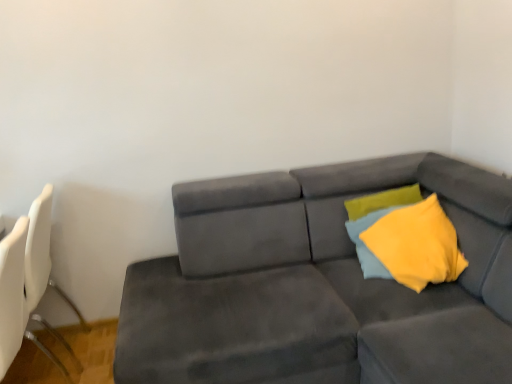
What do you see at coordinates (318, 284) in the screenshot? I see `suede gray couch at center` at bounding box center [318, 284].

Describe the element at coordinates (368, 227) in the screenshot. I see `soft yellow fabric pillow at right` at that location.

Identify the location of white plastic swivel chair at left. The width and height of the screenshot is (512, 384). (42, 266).

Is suede gray couch at center not near yellow fabric pillow at upper right?

suede gray couch at center is near yellow fabric pillow at upper right, not far away.

Considering the relative sizes of suede gray couch at center and yellow fabric pillow at upper right in the image provided, is suede gray couch at center wider than yellow fabric pillow at upper right?

Yes, suede gray couch at center is wider than yellow fabric pillow at upper right.

Is suede gray couch at center in front of or behind yellow fabric pillow at upper right in the image?

Clearly, suede gray couch at center is in front of yellow fabric pillow at upper right.

Considering the relative positions of suede gray couch at center and yellow fabric pillow at upper right in the image provided, is suede gray couch at center to the left of yellow fabric pillow at upper right from the viewer's perspective?

Yes, suede gray couch at center is to the left of yellow fabric pillow at upper right.

This screenshot has width=512, height=384. In order to click on swivel chair located underneath the soft yellow fabric pillow at right (from a real-world perspective) in this screenshot , I will do `click(42, 266)`.

Considering the sizes of objects soft yellow fabric pillow at right and white plastic swivel chair at left in the image provided, who is taller, soft yellow fabric pillow at right or white plastic swivel chair at left?

white plastic swivel chair at left.

Between point (372, 273) and point (39, 235), which one is positioned behind?

The point (39, 235) is farther.

From a real-world perspective, is suede gray couch at center under soft yellow fabric pillow at right?

Yes, from a real-world perspective, suede gray couch at center is under soft yellow fabric pillow at right.

Is suede gray couch at center next to soft yellow fabric pillow at right and touching it?

There is a gap between suede gray couch at center and soft yellow fabric pillow at right.

Based on the photo, which of these two, suede gray couch at center or soft yellow fabric pillow at right, is bigger?

suede gray couch at center.

From the image's perspective, which one is positioned higher, suede gray couch at center or soft yellow fabric pillow at right?

soft yellow fabric pillow at right, from the image's perspective.

Looking at this image, from a real-world perspective, who is located lower, yellow fabric pillow at upper right or suede gray couch at center?

In real-world perspective, suede gray couch at center is lower.

Is yellow fabric pillow at upper right far away from suede gray couch at center?

No, yellow fabric pillow at upper right is not far away from suede gray couch at center.

Does yellow fabric pillow at upper right lie behind suede gray couch at center?

Yes, yellow fabric pillow at upper right is further from the viewer.

Which of these two, yellow fabric pillow at upper right or suede gray couch at center, is smaller?

yellow fabric pillow at upper right.

Find the location of a particular element. The image size is (512, 384). studio couch directly beneath the white plastic swivel chair at left (from a real-world perspective) is located at coordinates (318, 284).

Is white plastic swivel chair at left surrounding suede gray couch at center?

No, suede gray couch at center is located outside of white plastic swivel chair at left.

Is white plastic swivel chair at left oriented away from suede gray couch at center?

Yes, suede gray couch at center is at the back of white plastic swivel chair at left.

How far apart are white plastic swivel chair at left and suede gray couch at center?

white plastic swivel chair at left is 3.63 feet from suede gray couch at center.

Is soft yellow fabric pillow at right wider or thinner than yellow fabric pillow at upper right?

Clearly, soft yellow fabric pillow at right has less width compared to yellow fabric pillow at upper right.

Does soft yellow fabric pillow at right have a larger size compared to yellow fabric pillow at upper right?

No.

How different are the orientations of soft yellow fabric pillow at right and yellow fabric pillow at upper right in degrees?

The facing directions of soft yellow fabric pillow at right and yellow fabric pillow at upper right are 0.000164 degrees apart.

You are a GUI agent. You are given a task and a screenshot of the screen. Output one action in this format:
    pyautogui.click(x=<x>, y=<y>)
    Task: Click on the pillow on the left of the yellow fabric pillow at upper right
    
    Given the screenshot: What is the action you would take?
    pyautogui.click(x=368, y=227)

Is suede gray couch at center at the right side of white plastic swivel chair at left?

Yes.

Can you confirm if suede gray couch at center is taller than white plastic swivel chair at left?

No, suede gray couch at center is not taller than white plastic swivel chair at left.

Between suede gray couch at center and white plastic swivel chair at left, which one has larger size?

Bigger between the two is suede gray couch at center.

Where is `throw pillow that is above the suede gray couch at center (from the image's perspective)`? This screenshot has height=384, width=512. throw pillow that is above the suede gray couch at center (from the image's perspective) is located at coordinates (417, 244).

Identify the location of swivel chair on the left side of soft yellow fabric pillow at right. (42, 266).

From the picture: From the image, which object appears to be nearer to suede gray couch at center, yellow fabric pillow at upper right or white plastic swivel chair at left?

Based on the image, yellow fabric pillow at upper right appears to be nearer to suede gray couch at center.

Based on their spatial positions, is white plastic swivel chair at left or suede gray couch at center further from yellow fabric pillow at upper right?

Based on the image, white plastic swivel chair at left appears to be further to yellow fabric pillow at upper right.

From the image, which object appears to be nearer to yellow fabric pillow at upper right, soft yellow fabric pillow at right or white plastic swivel chair at left?

soft yellow fabric pillow at right.

Based on their spatial positions, is white plastic swivel chair at left or yellow fabric pillow at upper right closer to suede gray couch at center?

Based on the image, yellow fabric pillow at upper right appears to be nearer to suede gray couch at center.

When comparing their distances from white plastic swivel chair at left, does yellow fabric pillow at upper right or suede gray couch at center seem further?

yellow fabric pillow at upper right is positioned further to the anchor white plastic swivel chair at left.

From the picture: Considering their positions, is white plastic swivel chair at left positioned further to soft yellow fabric pillow at right than suede gray couch at center?

white plastic swivel chair at left lies further to soft yellow fabric pillow at right than the other object.

Looking at the image, which one is located closer to soft yellow fabric pillow at right, yellow fabric pillow at upper right or white plastic swivel chair at left?

Based on the image, yellow fabric pillow at upper right appears to be nearer to soft yellow fabric pillow at right.

Looking at the image, which one is located further to suede gray couch at center, soft yellow fabric pillow at right or white plastic swivel chair at left?

Among the two, white plastic swivel chair at left is located further to suede gray couch at center.

At what (x,y) coordinates should I click in order to perform the action: click on throw pillow positioned between suede gray couch at center and soft yellow fabric pillow at right from near to far. Please return your answer as a coordinate pair (x, y). Looking at the image, I should click on (417, 244).

Find the location of a particular element. pillow between white plastic swivel chair at left and yellow fabric pillow at upper right from left to right is located at coordinates (368, 227).

The image size is (512, 384). Identify the location of studio couch located between white plastic swivel chair at left and soft yellow fabric pillow at right in the left-right direction. (318, 284).

This screenshot has height=384, width=512. Identify the location of studio couch between white plastic swivel chair at left and yellow fabric pillow at upper right. (318, 284).